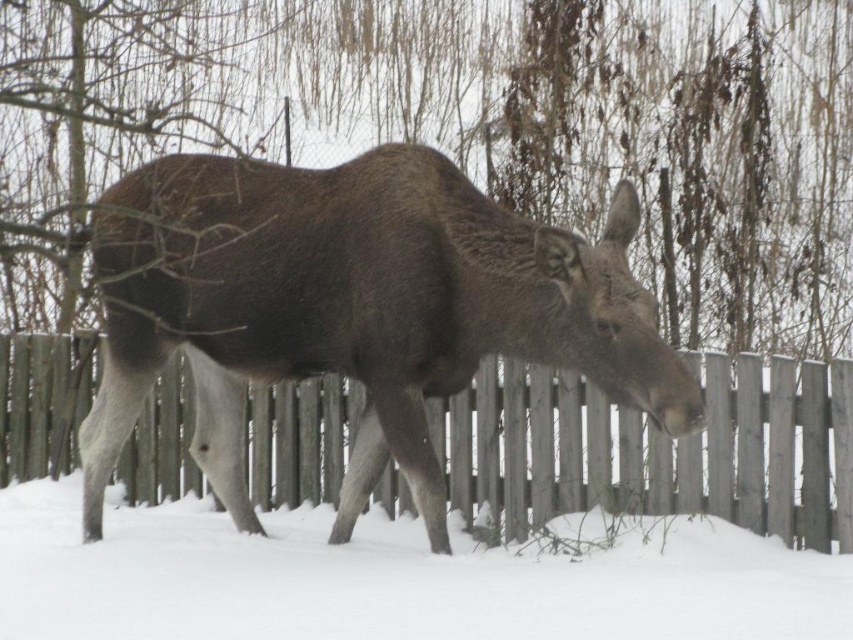
You are a photographer trying to capture the brown furry deer at center and the wooden fence at center in the same frame. Based on their positions, which object should you adjust your camera to focus on first to ensure both are in the shot?

The brown furry deer at center is to the left of the wooden fence at center, so you should focus on the wooden fence at center first to ensure both are in the frame.

You are a snowplow operator who needs to clear a path between the white fluffy snow at lower center and the wooden fence at center. The snowplow requires a minimum of 1.5 meters of space to operate. Can you safely operate the snowplow in this area?

The distance between the white fluffy snow at lower center and the wooden fence at center is 1.62 meters, which is greater than the required 1.5 meters. Therefore, the snowplow can safely operate in this area.

You are an animal tracker trying to follow the moose through the snowy landscape. The white fluffy snow at lower center and the wooden fence at center are both in your path. Which object takes up more space in the scene?

The wooden fence at center occupies more space than the white fluffy snow at lower center, so the wooden fence at center takes up more space in the scene.